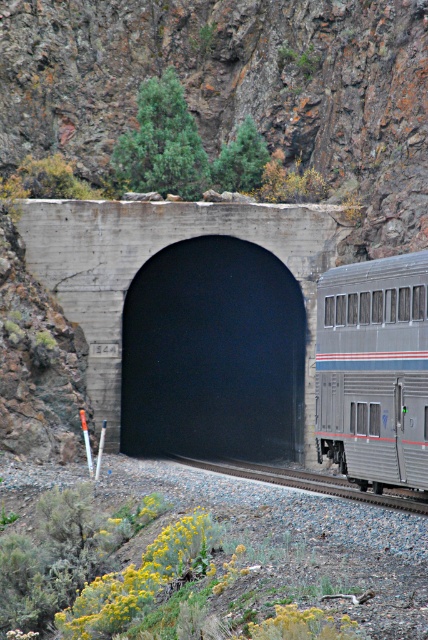
Find the location of a particular element. This screenshot has width=428, height=640. silver metallic train car at center is located at coordinates (374, 371).

Which is below, black concrete tunnel at center or silver metallic train car at center?

black concrete tunnel at center is below.

Is black concrete tunnel at center taller than silver metallic train car at center?

Indeed, black concrete tunnel at center has a greater height compared to silver metallic train car at center.

What do you see at coordinates (213, 355) in the screenshot? I see `black concrete tunnel at center` at bounding box center [213, 355].

This screenshot has height=640, width=428. Identify the location of black concrete tunnel at center. tap(213, 355).

Is black concrete tunnel at center smaller than metal train track at lower center?

Incorrect, black concrete tunnel at center is not smaller in size than metal train track at lower center.

Based on the photo, who is higher up, black concrete tunnel at center or metal train track at lower center?

black concrete tunnel at center is above.

Who is more distant from viewer, (124,426) or (397,502)?

The point (124,426) is more distant.

Identify the location of black concrete tunnel at center. (213, 355).